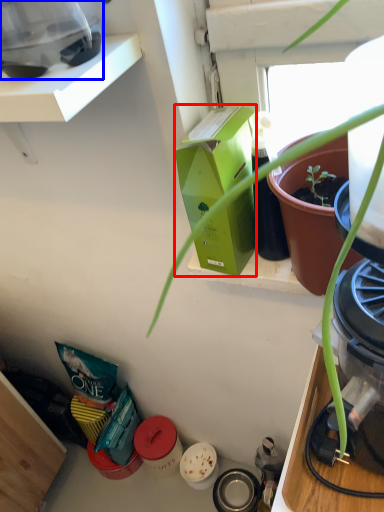
Question: Among these objects, which one is nearest to the camera, box (highlighted by a red box) or appliance (highlighted by a blue box)?

Choices:
 (A) box
 (B) appliance

Answer: (B)